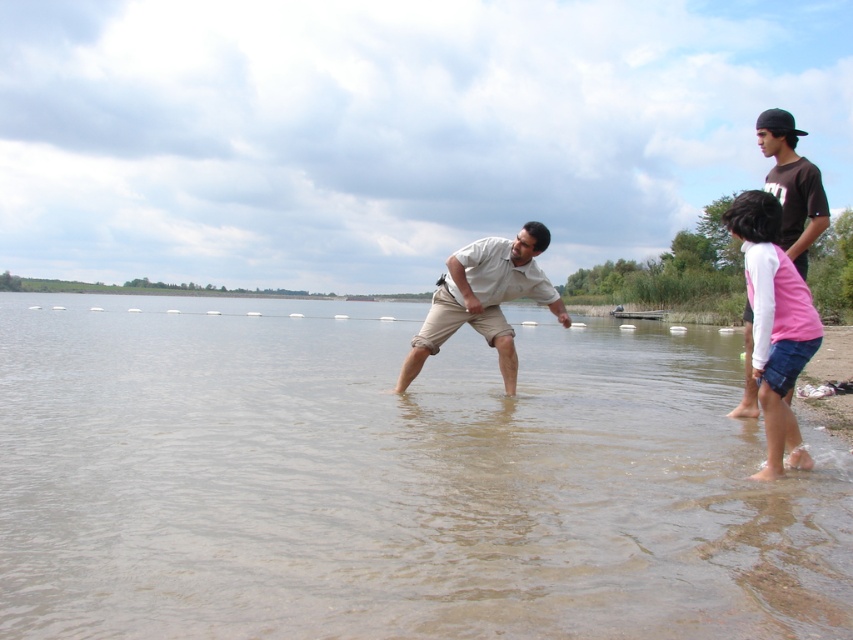
Question: Does clear water at center have a smaller size compared to beige cotton shirt at center?

Choices:
 (A) yes
 (B) no

Answer: (B)

Question: Which object is closer to the camera taking this photo?

Choices:
 (A) pink fabric shorts at lower right
 (B) beige cotton shirt at center
 (C) clear water at center

Answer: (C)

Question: Which of these objects is positioned farthest from the beige cotton shirt at center?

Choices:
 (A) clear water at center
 (B) pink fabric shorts at lower right

Answer: (A)

Question: Is clear water at center further to the viewer compared to beige cotton shirt at center?

Choices:
 (A) no
 (B) yes

Answer: (A)

Question: Which of the following is the closest to the observer?

Choices:
 (A) pink fabric shorts at lower right
 (B) clear water at center
 (C) beige cotton shirt at center

Answer: (B)

Question: From the image, what is the correct spatial relationship of pink fabric shorts at lower right in relation to beige cotton shirt at center?

Choices:
 (A) right
 (B) left

Answer: (A)